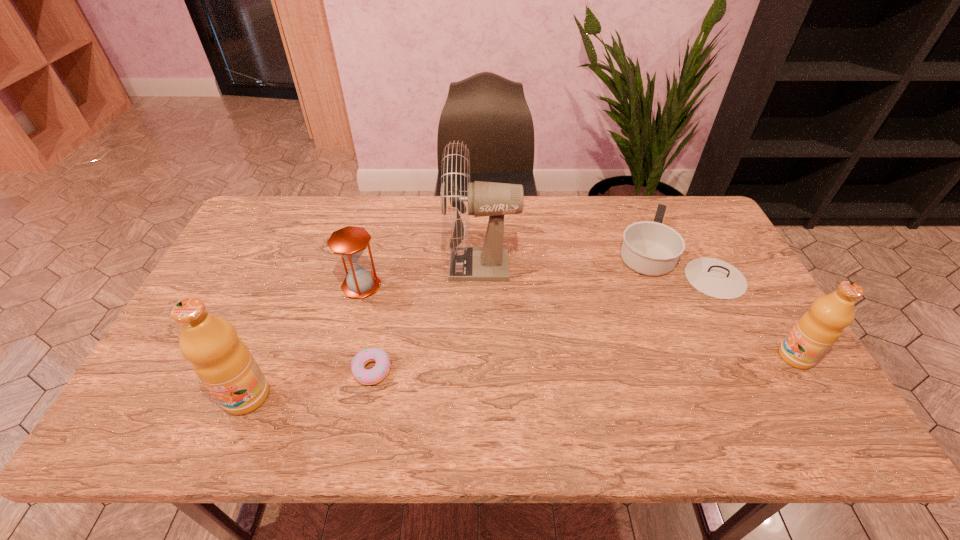
At what (x,y) coordinates should I click in order to perform the action: click on free spot between the saucepan and the tallest object. Please return your answer as a coordinate pair (x, y). Looking at the image, I should click on (578, 259).

Locate an element on the screen. The image size is (960, 540). free space between the left fruit juice and the shortest object is located at coordinates (309, 383).

Identify the location of free area in between the saucepan and the shortest object. The width and height of the screenshot is (960, 540). (522, 312).

The height and width of the screenshot is (540, 960). I want to click on free space between the saucepan and the leftmost object, so click(460, 325).

Identify the location of empty location between the leftmost object and the second shortest object. (460, 325).

Where is `free space that is in between the leftmost object and the farther fruit juice`? The height and width of the screenshot is (540, 960). free space that is in between the leftmost object and the farther fruit juice is located at coordinates (521, 376).

You are a GUI agent. You are given a task and a screenshot of the screen. Output one action in this format:
    pyautogui.click(x=<x>, y=<y>)
    Task: Click on the vacant point located between the tallest object and the doughnut
    This screenshot has height=540, width=960.
    Given the screenshot: What is the action you would take?
    pyautogui.click(x=427, y=318)

Locate an element on the screen. vacant space that's between the hourglass and the fourth object from left to right is located at coordinates coord(421,275).

What are the coordinates of `empty space between the fifth tallest object and the third object from right to left` in the screenshot? It's located at (578, 259).

Identify which object is the fifth nearest to the farther fruit juice. Please provide its 2D coordinates. Your answer should be formatted as a tuple, i.e. [(x, y)], where the tuple contains the x and y coordinates of a point satisfying the conditions above.

[(222, 361)]